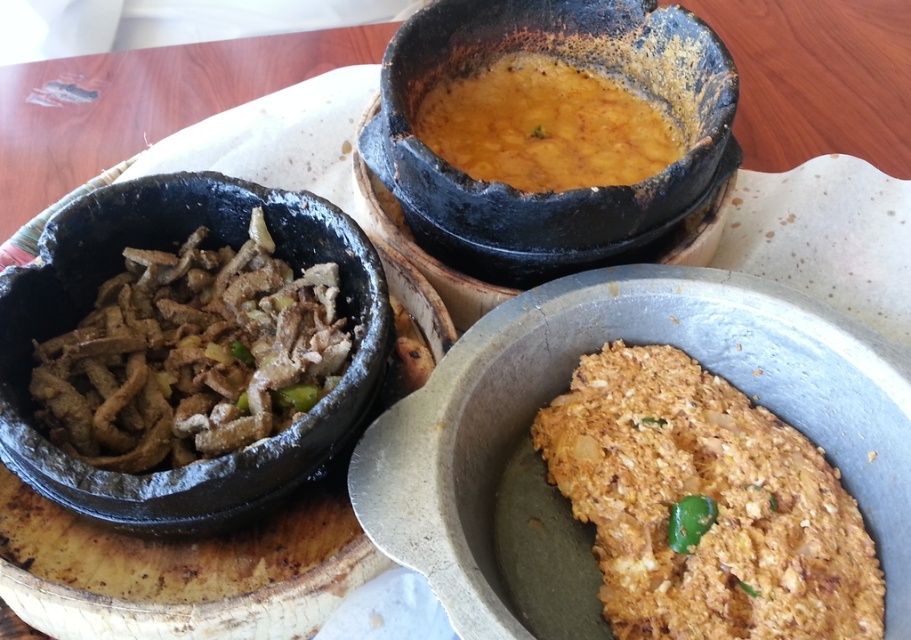
Can you confirm if golden crispy fried chicken at center is smaller than brown matte meat at left?

No.

Which is more to the right, golden crispy fried chicken at center or brown matte meat at left?

Positioned to the right is golden crispy fried chicken at center.

The width and height of the screenshot is (911, 640). Identify the location of golden crispy fried chicken at center. (705, 506).

The width and height of the screenshot is (911, 640). Find the location of `golden crispy fried chicken at center`. golden crispy fried chicken at center is located at coordinates (705, 506).

What do you see at coordinates (705, 506) in the screenshot? I see `golden crispy fried chicken at center` at bounding box center [705, 506].

Between point (718, 499) and point (538, 156), which one is positioned behind?

Point (538, 156)

Does point (853, 614) come closer to viewer compared to point (484, 125)?

Yes, it is in front of point (484, 125).

I want to click on golden crispy fried chicken at center, so click(705, 506).

Does brown matte meat at left lie in front of yellow-orange paste at center?

That is True.

Is brown matte meat at left below yellow-orange paste at center?

Yes, brown matte meat at left is below yellow-orange paste at center.

Who is more distant from viewer, (118, 275) or (447, 131)?

The point (447, 131) is behind.

You are a GUI agent. You are given a task and a screenshot of the screen. Output one action in this format:
    pyautogui.click(x=<x>, y=<y>)
    Task: Click on the brown matte meat at left
    The width and height of the screenshot is (911, 640).
    Given the screenshot: What is the action you would take?
    pyautogui.click(x=191, y=355)